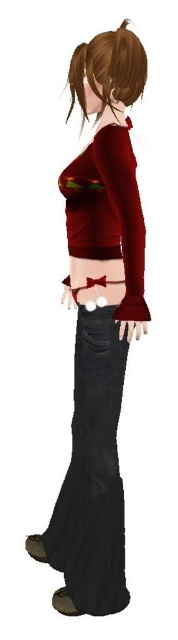
Which is in front, point (100, 364) or point (85, 256)?

Positioned in front is point (85, 256).

Is point (98, 404) positioned before point (98, 236)?

No.

Which is in front, point (98, 573) or point (79, 244)?

Point (79, 244) is in front.

This screenshot has height=640, width=178. I want to click on denim jeans at center, so click(92, 484).

Between matte red sweater at center and denim jeans at center, which one appears on the left side from the viewer's perspective?

Positioned to the left is denim jeans at center.

Does point (110, 204) lie behind point (84, 310)?

No.

Between point (122, 170) and point (98, 445), which one is positioned in front?

Point (122, 170)

Find the location of `matte red sweater at center`. matte red sweater at center is located at coordinates (101, 317).

Does matte red sweater at center appear on the left side of black matte pocket at lower center?

Indeed, matte red sweater at center is positioned on the left side of black matte pocket at lower center.

Does matte red sweater at center have a smaller size compared to black matte pocket at lower center?

No.

Is point (114, 536) in front of point (106, 349)?

No, (114, 536) is further to viewer.

At what (x,y) coordinates should I click in order to perform the action: click on matte red sweater at center. Please return your answer as a coordinate pair (x, y). Looking at the image, I should click on (101, 317).